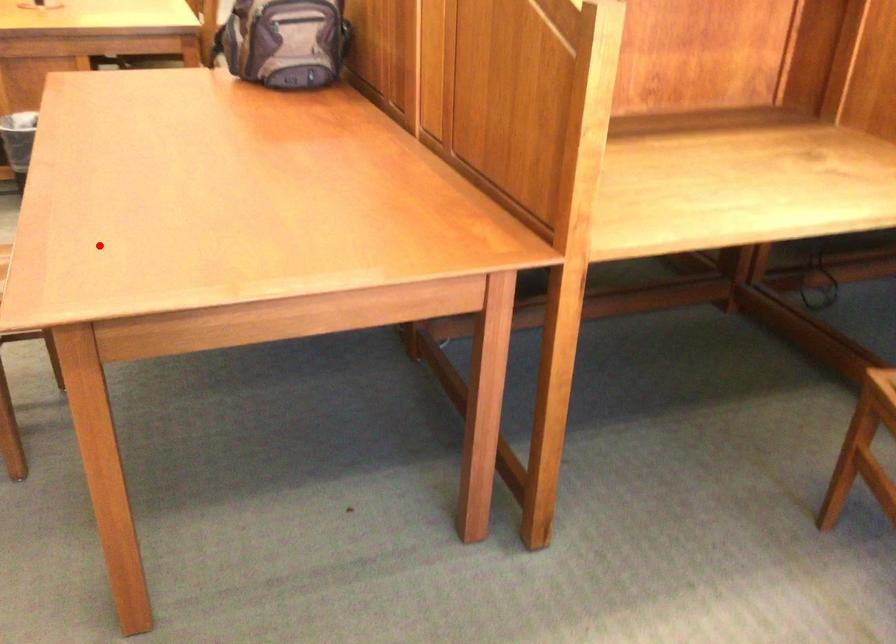
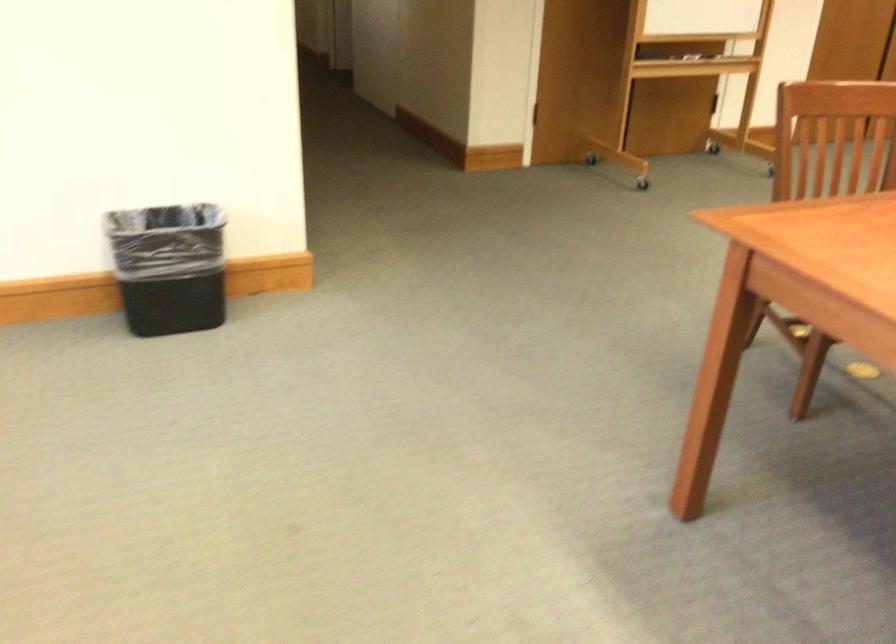
Question: I am providing you with two images of the same scene from different viewpoints. Image1 has a red point marked. In image2, the corresponding 3D location appears at what relative position? Reply with the corresponding letter.

Choices:
 (A) Closer
 (B) Farther

Answer: (B)